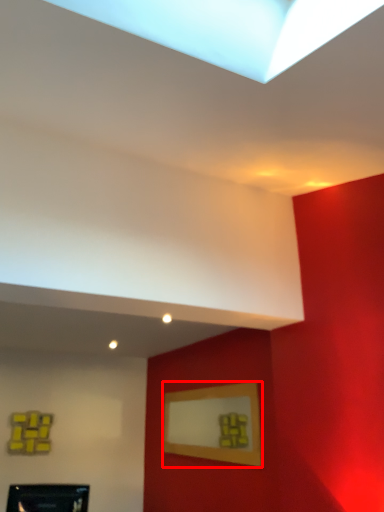
Question: In this image, where is picture frame (annotated by the red box) located relative to picture frame?

Choices:
 (A) left
 (B) right

Answer: (B)